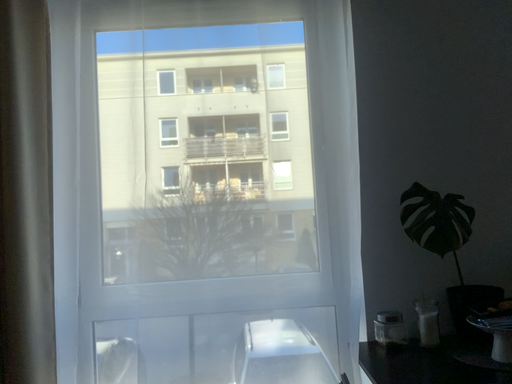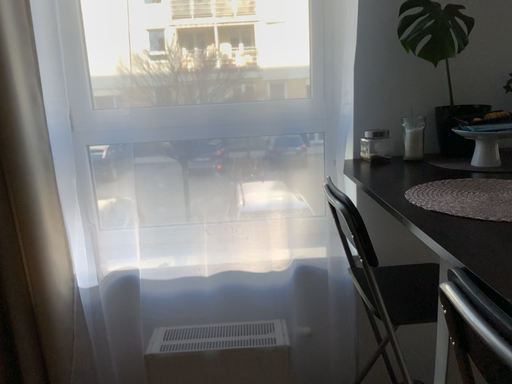
Question: Which way did the camera rotate in the video?

Choices:
 (A) rotated downward
 (B) rotated upward

Answer: (A)